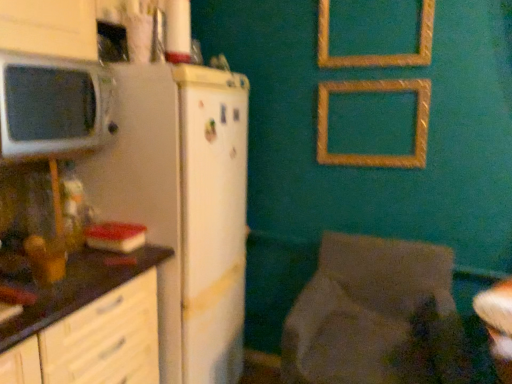
Question: In terms of size, does gold textured picture frame at upper center, which is counted as the 1th picture frame, starting from the bottom, appear bigger or smaller than white matte refrigerator at left?

Choices:
 (A) small
 (B) big

Answer: (A)

Question: Considering the positions of point (325, 160) and point (202, 374), is point (325, 160) closer or farther from the camera than point (202, 374)?

Choices:
 (A) farther
 (B) closer

Answer: (A)

Question: Which is nearer to the matte white microwave at left?

Choices:
 (A) white matte refrigerator at left
 (B) gold textured picture frame at upper center, which is counted as the second picture frame, starting from the bottom
 (C) white glossy table at lower right
 (D) dark brown laminate countertop at left
 (E) textured fabric chair at lower right

Answer: (A)

Question: Which of these objects is positioned farthest from the gold textured picture frame at upper center, the 1th picture frame positioned from the top?

Choices:
 (A) textured fabric chair at lower right
 (B) dark brown laminate countertop at left
 (C) matte white microwave at left
 (D) white matte refrigerator at left
 (E) white glossy table at lower right

Answer: (B)